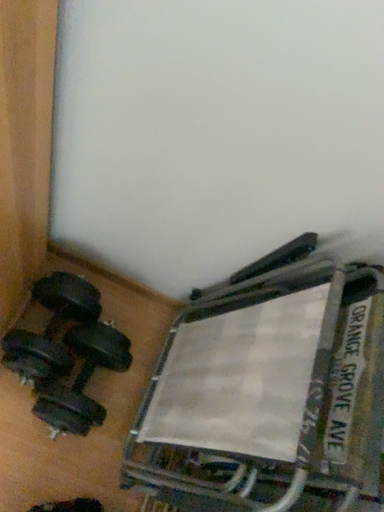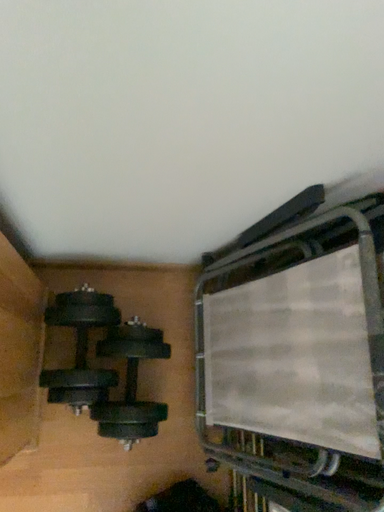
Question: Which way did the camera rotate in the video?

Choices:
 (A) rotated downward
 (B) rotated upward

Answer: (A)